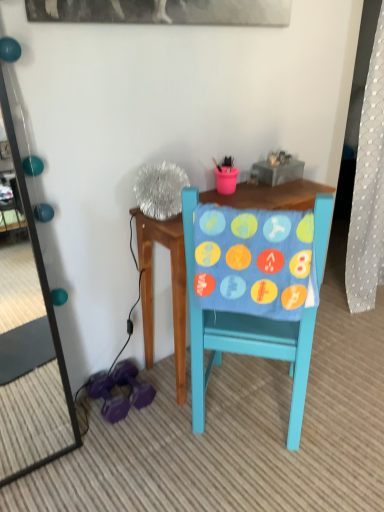
This screenshot has height=512, width=384. Identify the location of free space to the right of matte blue chair at center. (344, 401).